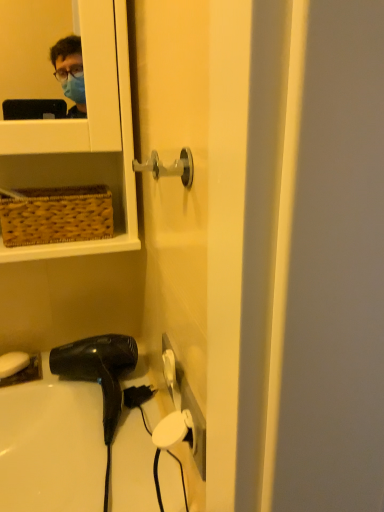
Question: Should I look upward or downward to see black matte hair dryer at lower left?

Choices:
 (A) up
 (B) down

Answer: (B)

Question: Can you confirm if black matte hair dryer at lower left is smaller than white matte soap at lower left?

Choices:
 (A) no
 (B) yes

Answer: (A)

Question: Is black matte hair dryer at lower left facing away from white matte soap at lower left?

Choices:
 (A) yes
 (B) no

Answer: (B)

Question: Is black matte hair dryer at lower left not near white matte soap at lower left?

Choices:
 (A) yes
 (B) no

Answer: (B)

Question: From a real-world perspective, is black matte hair dryer at lower left positioned under white matte soap at lower left based on gravity?

Choices:
 (A) no
 (B) yes

Answer: (A)

Question: Is black matte hair dryer at lower left thinner than white matte soap at lower left?

Choices:
 (A) no
 (B) yes

Answer: (A)

Question: Is black matte hair dryer at lower left next to white matte soap at lower left?

Choices:
 (A) no
 (B) yes

Answer: (A)

Question: Does white matte soap at lower left lie behind black matte hair dryer at lower left?

Choices:
 (A) no
 (B) yes

Answer: (B)

Question: Is white matte soap at lower left aimed at black matte hair dryer at lower left?

Choices:
 (A) yes
 (B) no

Answer: (B)

Question: Considering the relative sizes of white matte soap at lower left and black matte hair dryer at lower left in the image provided, is white matte soap at lower left smaller than black matte hair dryer at lower left?

Choices:
 (A) no
 (B) yes

Answer: (B)

Question: Is white matte soap at lower left not near black matte hair dryer at lower left?

Choices:
 (A) no
 (B) yes

Answer: (A)

Question: Does white matte soap at lower left lie in front of black matte hair dryer at lower left?

Choices:
 (A) yes
 (B) no

Answer: (B)

Question: Does white matte soap at lower left have a larger size compared to black matte hair dryer at lower left?

Choices:
 (A) no
 (B) yes

Answer: (A)

Question: From a real-world perspective, is white matte soap at lower left above or below black matte hair dryer at lower left?

Choices:
 (A) above
 (B) below

Answer: (B)